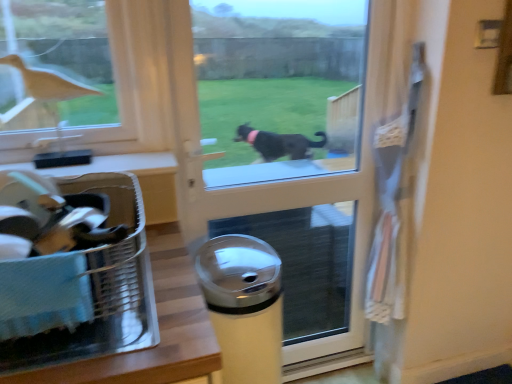
Question: Can you confirm if transparent glass screen door at center is shorter than matte brown bird at upper left?

Choices:
 (A) no
 (B) yes

Answer: (A)

Question: From a real-world perspective, is transparent glass screen door at center physically above matte brown bird at upper left?

Choices:
 (A) no
 (B) yes

Answer: (A)

Question: Considering the relative positions of transparent glass screen door at center and matte brown bird at upper left in the image provided, is transparent glass screen door at center to the right of matte brown bird at upper left from the viewer's perspective?

Choices:
 (A) yes
 (B) no

Answer: (A)

Question: From the image's perspective, is transparent glass screen door at center located beneath matte brown bird at upper left?

Choices:
 (A) yes
 (B) no

Answer: (A)

Question: From a real-world perspective, is transparent glass screen door at center located beneath matte brown bird at upper left?

Choices:
 (A) yes
 (B) no

Answer: (A)

Question: Looking at the image, does metallic silver trash can at center seem bigger or smaller compared to matte brown bird at upper left?

Choices:
 (A) big
 (B) small

Answer: (A)

Question: Considering the positions of metallic silver trash can at center and matte brown bird at upper left in the image, is metallic silver trash can at center wider or thinner than matte brown bird at upper left?

Choices:
 (A) thin
 (B) wide

Answer: (B)

Question: Considering the positions of metallic silver trash can at center and matte brown bird at upper left in the image, is metallic silver trash can at center taller or shorter than matte brown bird at upper left?

Choices:
 (A) tall
 (B) short

Answer: (A)

Question: Would you say metallic silver trash can at center is to the left or to the right of matte brown bird at upper left in the picture?

Choices:
 (A) left
 (B) right

Answer: (B)

Question: Is point (262, 158) positioned closer to the camera than point (109, 201)?

Choices:
 (A) farther
 (B) closer

Answer: (A)

Question: Considering the positions of transparent glass screen door at center and translucent plastic laundry basket at lower left in the image, is transparent glass screen door at center bigger or smaller than translucent plastic laundry basket at lower left?

Choices:
 (A) small
 (B) big

Answer: (B)

Question: In the image, is transparent glass screen door at center positioned in front of or behind translucent plastic laundry basket at lower left?

Choices:
 (A) behind
 (B) front

Answer: (A)

Question: From the image's perspective, is transparent glass screen door at center above or below translucent plastic laundry basket at lower left?

Choices:
 (A) below
 (B) above

Answer: (B)

Question: Is translucent plastic laundry basket at lower left in front of or behind matte brown bird at upper left in the image?

Choices:
 (A) front
 (B) behind

Answer: (A)

Question: Is translucent plastic laundry basket at lower left wider or thinner than matte brown bird at upper left?

Choices:
 (A) wide
 (B) thin

Answer: (A)